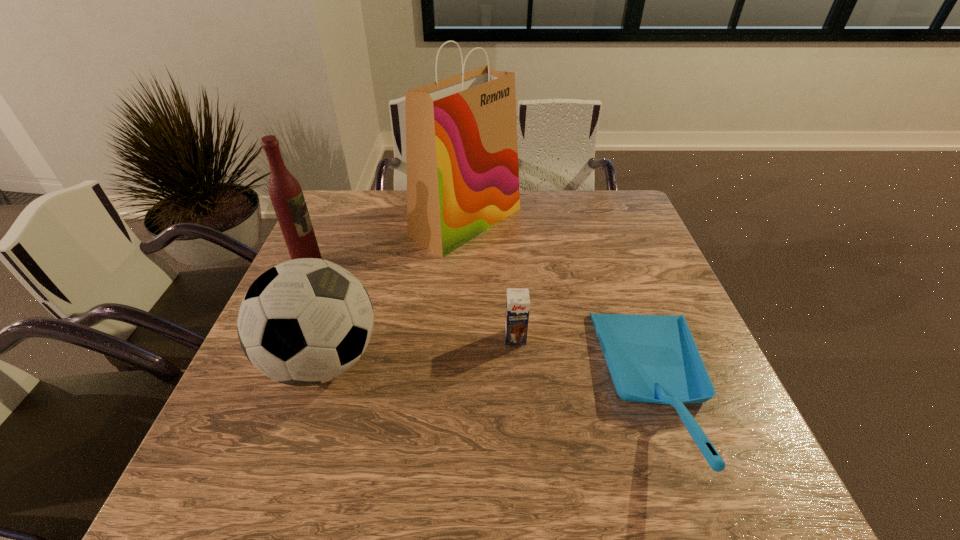
Identify the location of the farthest object. The width and height of the screenshot is (960, 540). (461, 132).

Locate an element on the screen. The width and height of the screenshot is (960, 540). the tallest object is located at coordinates (461, 132).

You are a GUI agent. You are given a task and a screenshot of the screen. Output one action in this format:
    pyautogui.click(x=<x>, y=<y>)
    Task: Click on the liquor
    
    Given the screenshot: What is the action you would take?
    click(285, 192)

Where is `the fourth nearest object`? The image size is (960, 540). the fourth nearest object is located at coordinates (285, 192).

Image resolution: width=960 pixels, height=540 pixels. Find the location of `the third tallest object`. the third tallest object is located at coordinates (306, 321).

Locate an element on the screen. The image size is (960, 540). chocolate milk is located at coordinates (517, 302).

I want to click on dustpan, so click(651, 358).

Locate an element on the screen. The width and height of the screenshot is (960, 540). blank area located on the left of the farthest object is located at coordinates (341, 222).

Find the location of a particular element. Image resolution: width=960 pixels, height=540 pixels. blank space located on the label of the second tallest object is located at coordinates (418, 267).

This screenshot has width=960, height=540. Identify the location of vacant region located on the main logo of the third tallest object. (453, 361).